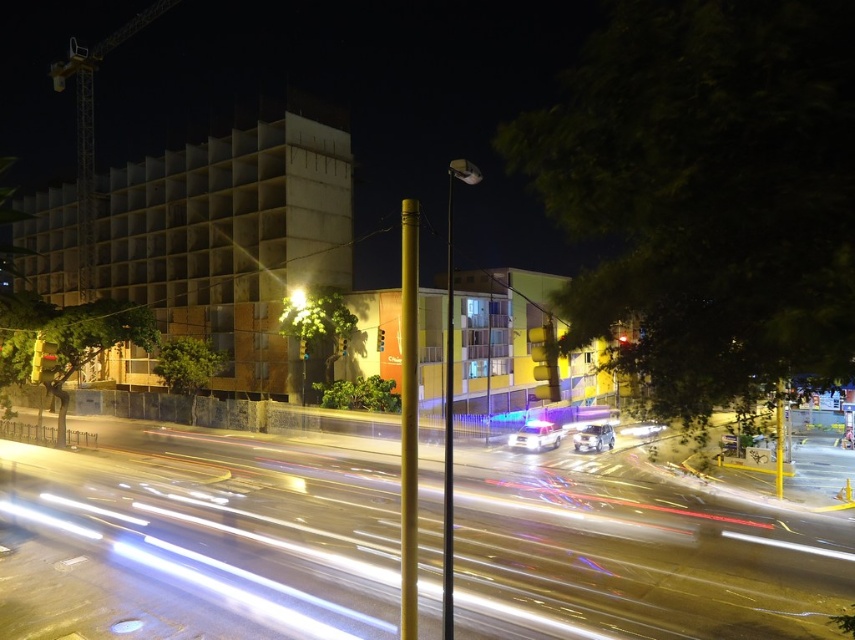
Describe the element at coordinates (594, 436) in the screenshot. I see `shiny silver car at center` at that location.

Can you confirm if shiny silver car at center is taller than matte yellow light at center?

Yes.

Who is more forward, (593,429) or (299,294)?

Positioned in front is point (593,429).

In order to click on shiny silver car at center in this screenshot , I will do click(x=594, y=436).

Can you confirm if white glossy car at center is shorter than matte yellow light at center?

Correct, white glossy car at center is not as tall as matte yellow light at center.

Identify the location of white glossy car at center. (535, 435).

Does point (535, 449) lie in front of point (292, 291)?

Yes, it is in front of point (292, 291).

The width and height of the screenshot is (855, 640). I want to click on white glossy car at center, so click(535, 435).

Image resolution: width=855 pixels, height=640 pixels. What do you see at coordinates (535, 435) in the screenshot?
I see `white glossy car at center` at bounding box center [535, 435].

Between white glossy car at center and shiny silver car at center, which one is positioned higher?

shiny silver car at center

Is point (537, 422) positioned in front of point (603, 436)?

No, (537, 422) is behind (603, 436).

I want to click on white glossy car at center, so pos(535,435).